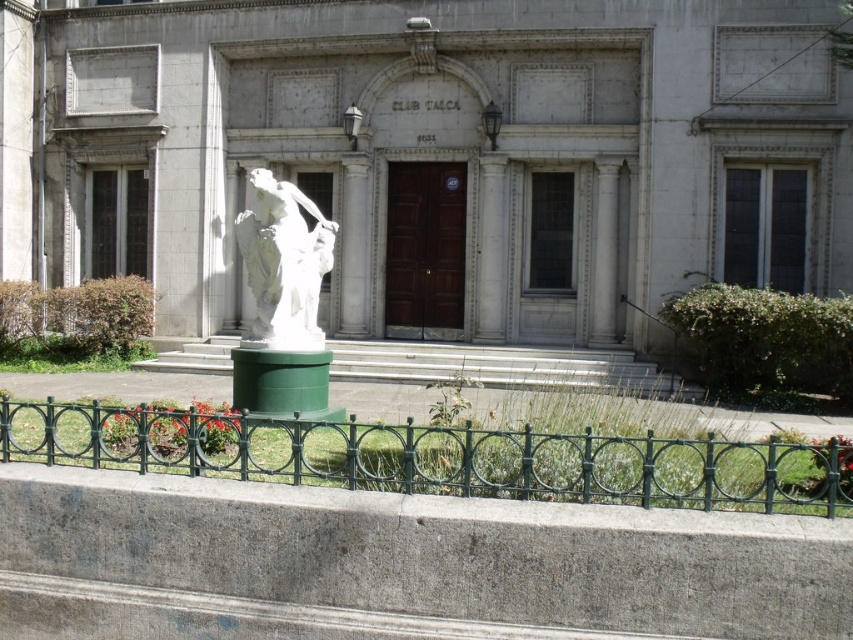
You are a visitor approaching the CLUB TALCA building. You notice a green wrought iron fence at lower center and a white marble statue at center. Which object is taller when viewed from the front?

The white marble statue at center is taller than the green wrought iron fence at lower center.

You are a visitor approaching the entrance of CLUB TALCA and want to get a clear view of the white marble statue at center. However, there is a green wrought iron fence at lower center in your path. Based on their sizes, do you think you can see the statue over the fence?

The green wrought iron fence at lower center is larger than the white marble statue at center, so the statue might be partially or fully obscured by the fence depending on the fence height and your viewing angle. However, since the fence is at lower center and the statue is at center, you might still have a clear view if the fence isn

You are a visitor approaching the CLUB TALCA entrance. You see the green wrought iron fence at lower center and the white marble statue at center. Which object is closer to the entrance of the building?

The green wrought iron fence at lower center is closer to the entrance of the building because it is located below the white marble statue at center, meaning it is positioned in front of the statue and nearer to the entrance.